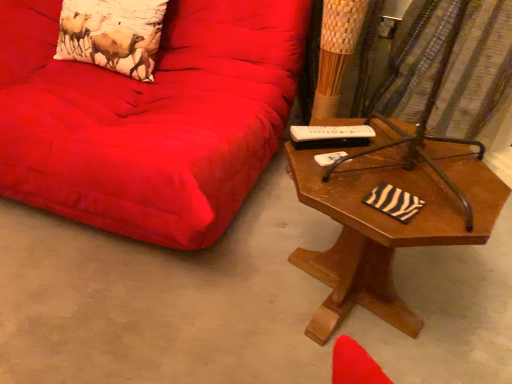
Locate an element on the screen. vacant space underneath brown wooden table at right (from a real-world perspective) is located at coordinates (x=351, y=309).